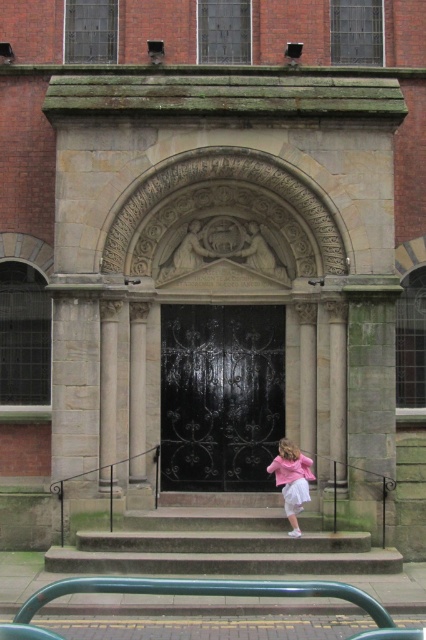
You are standing at the entrance of the building and want to reach the green painted metal rail at lower center. According to the coordinates provided, what are the x and y values you need to move towards?

The green painted metal rail at lower center is located at coordinates point 0.928 on the x axis and 0.500 on the y axis.

You are standing at the entrance of the building and want to go up the stairs. Where exactly are the smooth stone stairs at center located in relation to the archway and columns?

The smooth stone stairs at center are located at point coordinates of (221, 545), which is directly in front of the archway between the two columns.

You are a guest arriving at the building entrance. You see the smooth stone stairs at center and the pink satin dress at lower right. Which object is positioned to the right side of the other?

The smooth stone stairs at center is to the left of pink satin dress at lower right, so the pink satin dress at lower right is positioned to the right side of the smooth stone stairs at center.